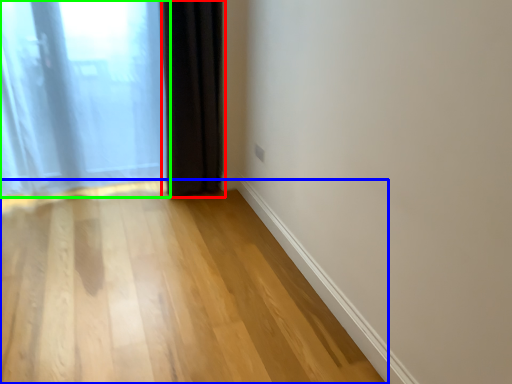
Question: Based on their relative distances, which object is nearer to curtain (highlighted by a red box)? Choose from corridor (highlighted by a blue box) and curtain (highlighted by a green box).

Choices:
 (A) corridor
 (B) curtain

Answer: (B)